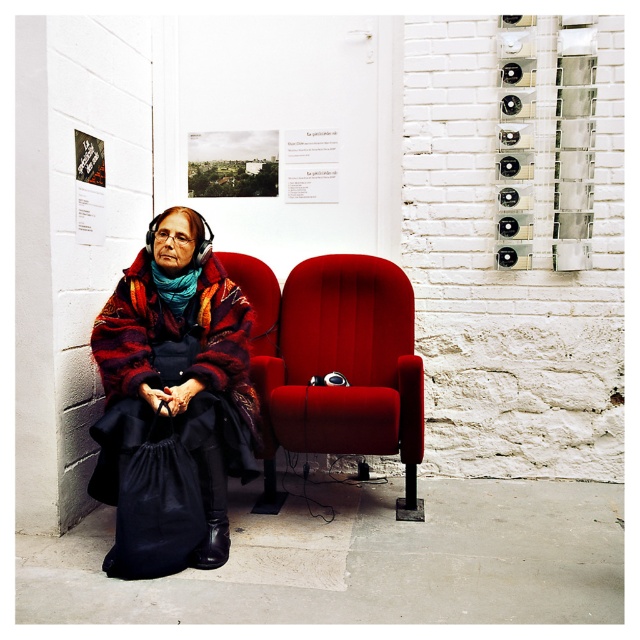
Can you confirm if velvet-like scarf at center is thinner than velvet red armchair at center?

Yes, velvet-like scarf at center is thinner than velvet red armchair at center.

Is velvet-like scarf at center wider than velvet red armchair at center?

No.

Between point (99, 332) and point (365, 362), which one is positioned behind?

The point (365, 362) is more distant.

At what (x,y) coordinates should I click in order to perform the action: click on velvet-like scarf at center. Please return your answer as a coordinate pair (x, y). Looking at the image, I should click on (177, 374).

Based on the photo, can you confirm if velvet-like scarf at center is positioned to the left of teal knitted scarf at left?

No, velvet-like scarf at center is not to the left of teal knitted scarf at left.

Which is in front, point (128, 332) or point (193, 268)?

Positioned in front is point (128, 332).

Where is `velvet-like scarf at center`? The image size is (640, 640). velvet-like scarf at center is located at coordinates (177, 374).

Does point (266, 477) come behind point (161, 284)?

Yes, point (266, 477) is behind point (161, 284).

In order to click on velvet red armchair at center in this screenshot , I will do `click(342, 371)`.